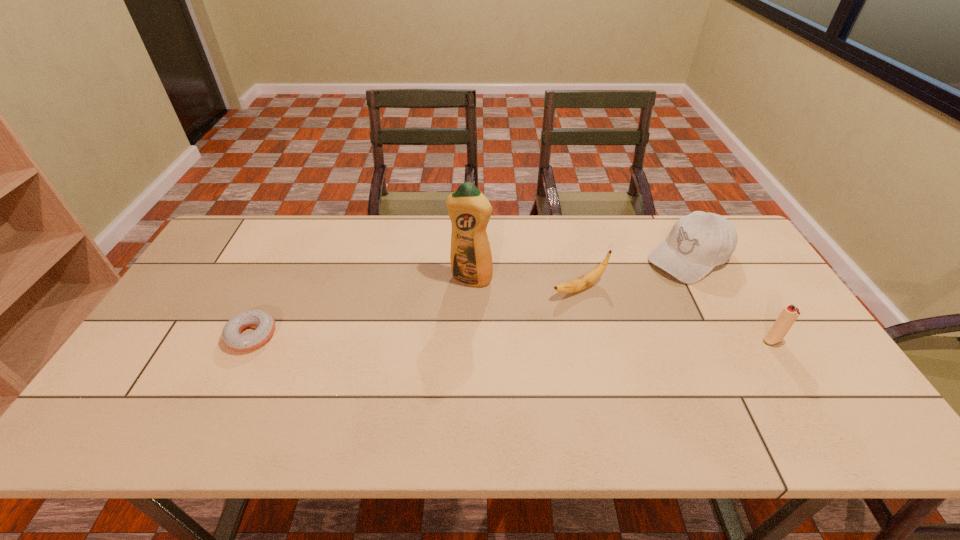
You are a GUI agent. You are given a task and a screenshot of the screen. Output one action in this format:
    pyautogui.click(x=<x>, y=<y>)
    Task: Click on the vacant space that is in between the baseball cap and the fourth tallest object
    
    Given the screenshot: What is the action you would take?
    pyautogui.click(x=635, y=273)

Where is `vacant space in between the shortest object and the igniter`? Image resolution: width=960 pixels, height=540 pixels. vacant space in between the shortest object and the igniter is located at coordinates (512, 338).

Identify the location of free space between the detergent and the leftmost object. (362, 307).

Where is `vacant space that's between the baseball cap and the leftmost object`? This screenshot has height=540, width=960. vacant space that's between the baseball cap and the leftmost object is located at coordinates (470, 296).

The width and height of the screenshot is (960, 540). Identify the location of free spot between the baseball cap and the shortest object. (470, 296).

Image resolution: width=960 pixels, height=540 pixels. What are the coordinates of `vacant region between the igniter and the tallest object` in the screenshot? It's located at (621, 310).

At what (x,y) coordinates should I click in order to perform the action: click on empty space that is in between the igniter and the shortest object. Please return your answer as a coordinate pair (x, y). This screenshot has height=540, width=960. Looking at the image, I should click on (512, 338).

At what (x,y) coordinates should I click in order to perform the action: click on vacant area that lies between the baseball cap and the detergent. Please return your answer as a coordinate pair (x, y). The width and height of the screenshot is (960, 540). Looking at the image, I should click on (580, 268).

Locate an element on the screen. This screenshot has height=540, width=960. vacant area between the banana and the baseball cap is located at coordinates (635, 273).

Locate an element on the screen. The width and height of the screenshot is (960, 540). object that is the third closest one to the third object from left to right is located at coordinates (790, 313).